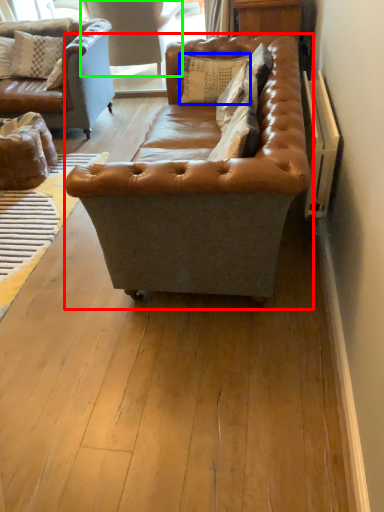
Question: Estimate the real-world distances between objects in this image. Which object is closer to studio couch (highlighted by a red box), pillow (highlighted by a blue box) or swivel chair (highlighted by a green box)?

Choices:
 (A) pillow
 (B) swivel chair

Answer: (A)